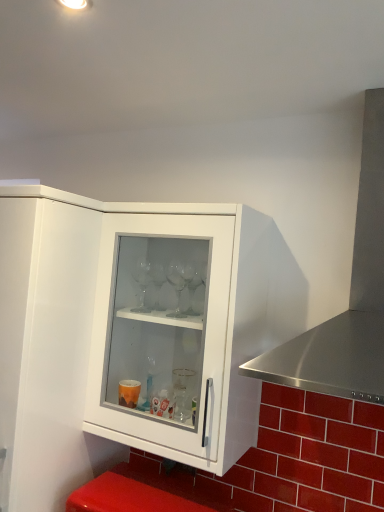
Question: In terms of width, does white glossy cabinet at upper left look wider or thinner when compared to transparent glass cabinet at center?

Choices:
 (A) thin
 (B) wide

Answer: (B)

Question: Considering their positions, is white glossy cabinet at upper left located in front of or behind transparent glass cabinet at center?

Choices:
 (A) front
 (B) behind

Answer: (A)

Question: Which object is the closest to the stainless steel exhaust hood at right?

Choices:
 (A) white glossy cabinet at upper left
 (B) transparent glass cabinet at center

Answer: (B)

Question: Based on their relative distances, which object is farther from the transparent glass cabinet at center?

Choices:
 (A) white glossy cabinet at upper left
 (B) stainless steel exhaust hood at right

Answer: (B)